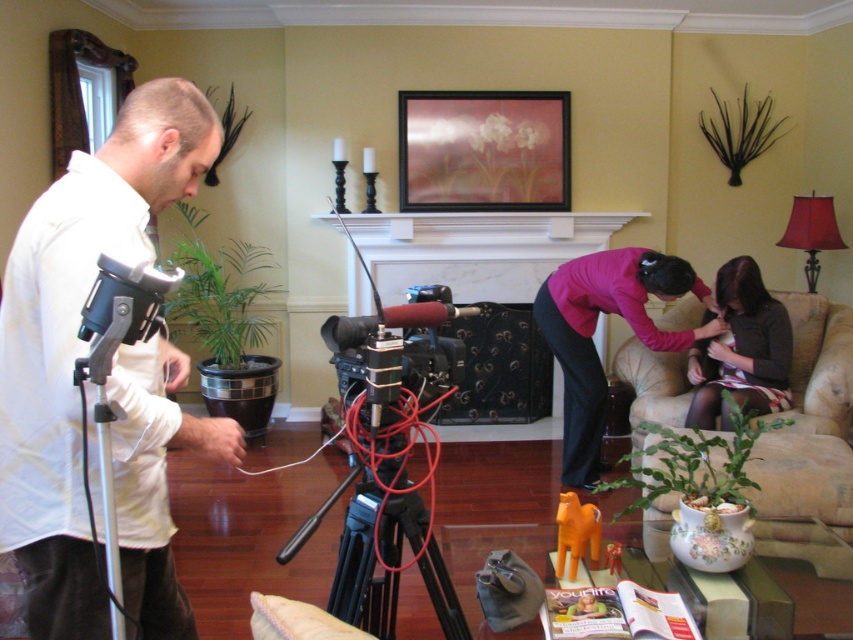
You are setting up a video shoot in this living room. You need to place a wide camera setup that requires a wider base for stability. Which tripod, the white matte tripod at left or the black matte tripod at center, should you choose?

The white matte tripod at left has a greater width than the black matte tripod at center, so you should choose the white matte tripod at left for better stability.

You are a film director in the living room. You want to place a new decorative item at point (483,150). However, there is already an object there. What is the object at that point?

The metallic gold picture frame at upper center is located at point (483,150).

You are a photographer setting up a shoot in the living room. You need to position a 1.2m tall tripod between the beige fabric armchair at lower right and the matte black shirt at lower right. Can the tripod fit vertically between them without touching either?

The beige fabric armchair at lower right is taller than the matte black shirt at lower right. Since the tripod is 1.2m tall, it can fit vertically between them as long as there is enough horizontal space, but the exact vertical clearance depends on the height difference between the armchair and the shirt. However, since the armchair is taller, the minimum height available would be based on the shirt, so if the shirt is shorter than 1.2m, the tripod might not fit. The given information does not specify their